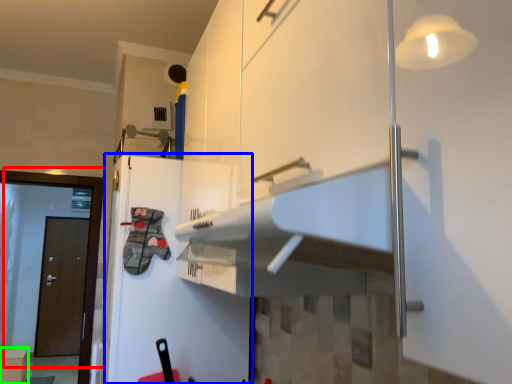
Question: Which is farther away from door (highlighted by a red box)? fridge (highlighted by a blue box) or cabinetry (highlighted by a green box)?

Choices:
 (A) fridge
 (B) cabinetry

Answer: (B)